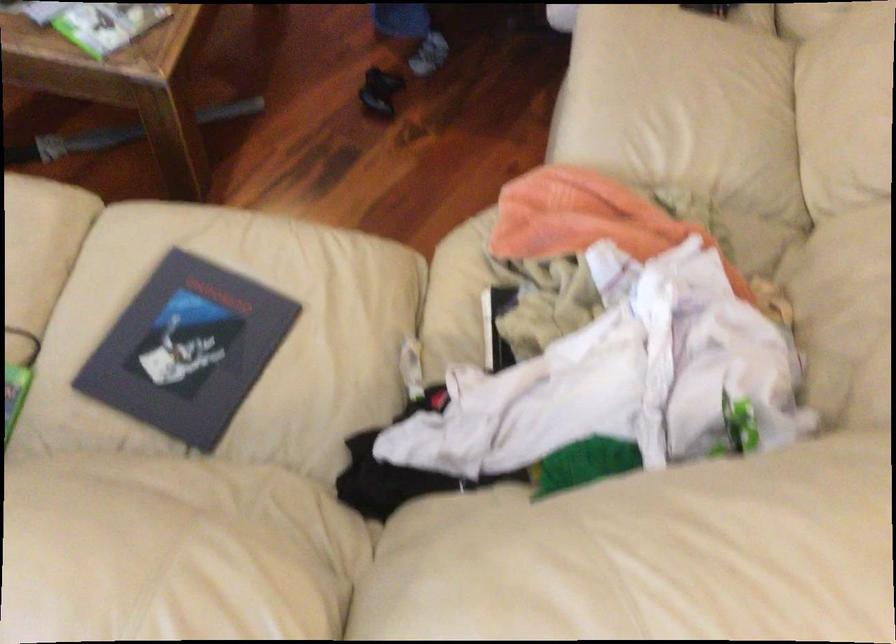
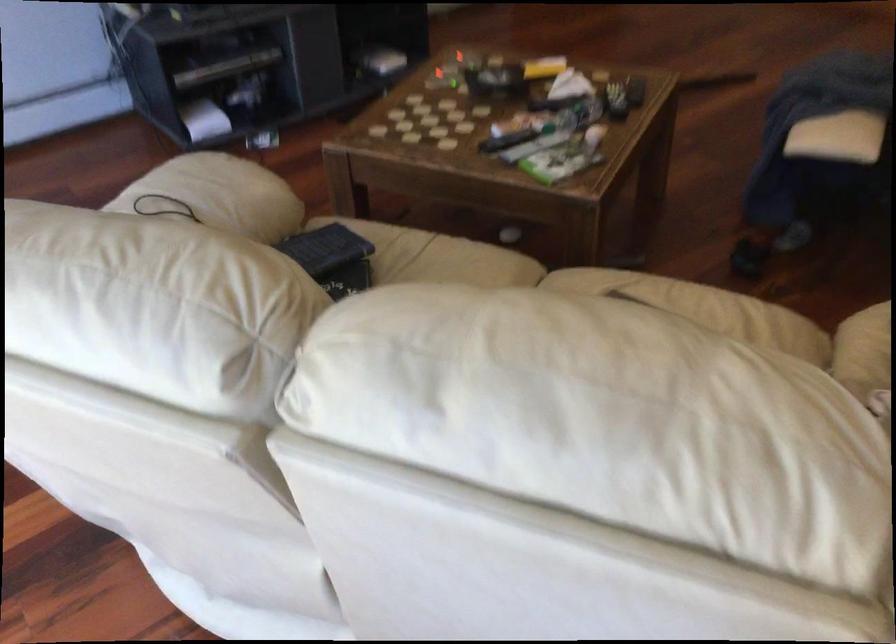
From the picture: First-person continuous shooting, in which direction is the camera rotating?

The rotation direction of the camera is left-up.